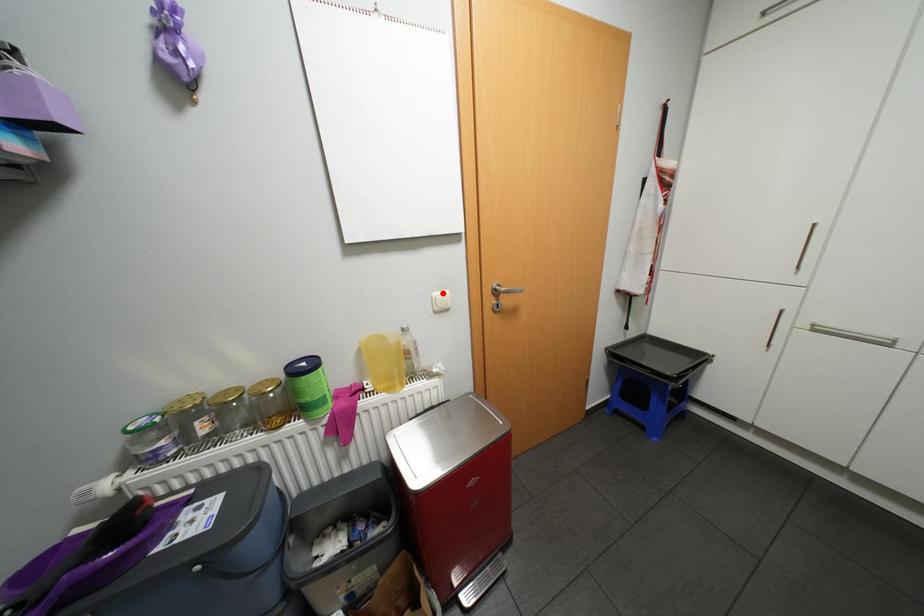
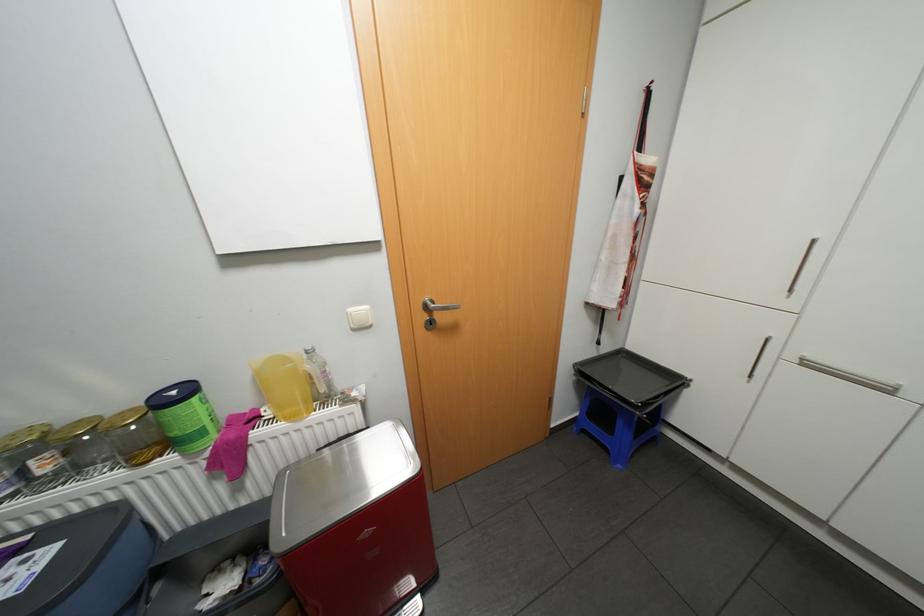
Question: I am providing you with two images of the same scene from different viewpoints. A red point is marked on the first image. Is the red point's position out of view in image 2?

Choices:
 (A) Yes
 (B) No

Answer: (B)